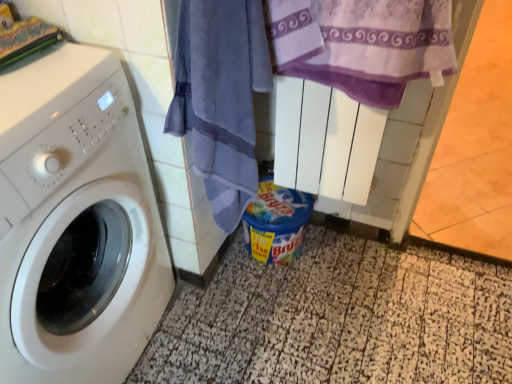
Question: Can you confirm if purple textured towel at upper right, the second beach towel from the left, is shorter than white glossy washing machine at left?

Choices:
 (A) yes
 (B) no

Answer: (A)

Question: Would you say purple textured towel at upper right, which is counted as the first beach towel, starting from the right, is outside white glossy washing machine at left?

Choices:
 (A) yes
 (B) no

Answer: (A)

Question: Does purple textured towel at upper right, which is counted as the first beach towel, starting from the right, have a greater width compared to white glossy washing machine at left?

Choices:
 (A) no
 (B) yes

Answer: (A)

Question: From the image's perspective, would you say purple textured towel at upper right, which is counted as the first beach towel, starting from the right, is positioned over white glossy washing machine at left?

Choices:
 (A) no
 (B) yes

Answer: (B)

Question: Can you confirm if purple textured towel at upper right, which is counted as the first beach towel, starting from the right, is positioned to the left of white glossy washing machine at left?

Choices:
 (A) yes
 (B) no

Answer: (B)

Question: From a real-world perspective, is purple textured towel at upper right, which is counted as the first beach towel, starting from the right, physically located above or below white glossy washing machine at left?

Choices:
 (A) below
 (B) above

Answer: (B)

Question: In terms of width, does purple textured towel at upper right, the second beach towel from the left, look wider or thinner when compared to white glossy washing machine at left?

Choices:
 (A) wide
 (B) thin

Answer: (B)

Question: From the image's perspective, is purple textured towel at upper right, the second beach towel from the left, above or below white glossy washing machine at left?

Choices:
 (A) above
 (B) below

Answer: (A)

Question: Is purple textured towel at upper right, which is counted as the first beach towel, starting from the right, situated inside white glossy washing machine at left or outside?

Choices:
 (A) outside
 (B) inside

Answer: (A)

Question: Is point (129, 233) closer or farther from the camera than point (400, 77)?

Choices:
 (A) farther
 (B) closer

Answer: (A)

Question: Is white glossy washing machine at left spatially inside purple textured towel at upper right, which is counted as the first beach towel, starting from the right, or outside of it?

Choices:
 (A) inside
 (B) outside

Answer: (B)

Question: Looking at their shapes, would you say white glossy washing machine at left is wider or thinner than purple textured towel at upper right, the second beach towel from the left?

Choices:
 (A) thin
 (B) wide

Answer: (B)

Question: From a real-world perspective, is white glossy washing machine at left positioned above or below purple textured towel at upper right, the second beach towel from the left?

Choices:
 (A) above
 (B) below

Answer: (B)

Question: Would you say white glossy washing machine at left is to the left or to the right of blue cotton towel at center, the first beach towel from the left, in the picture?

Choices:
 (A) left
 (B) right

Answer: (A)

Question: In terms of width, does white glossy washing machine at left look wider or thinner when compared to blue cotton towel at center, which is counted as the second beach towel, starting from the right?

Choices:
 (A) thin
 (B) wide

Answer: (B)